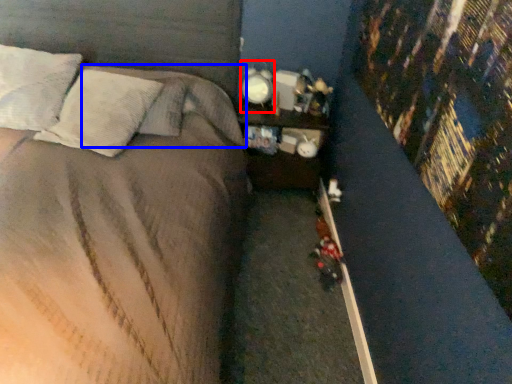
Question: Which point is further to the camera, bedside lamp (highlighted by a red box) or pillow (highlighted by a blue box)?

Choices:
 (A) bedside lamp
 (B) pillow

Answer: (A)